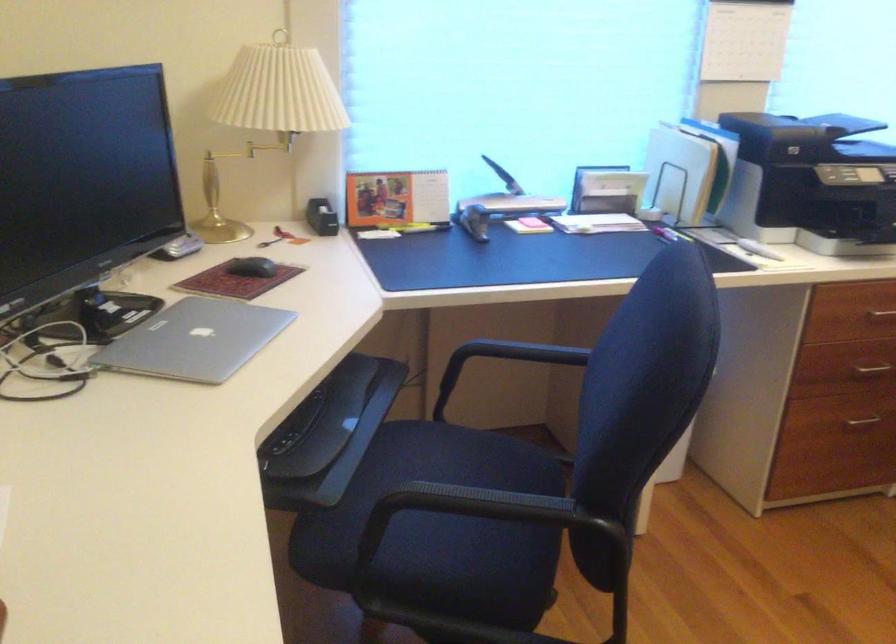
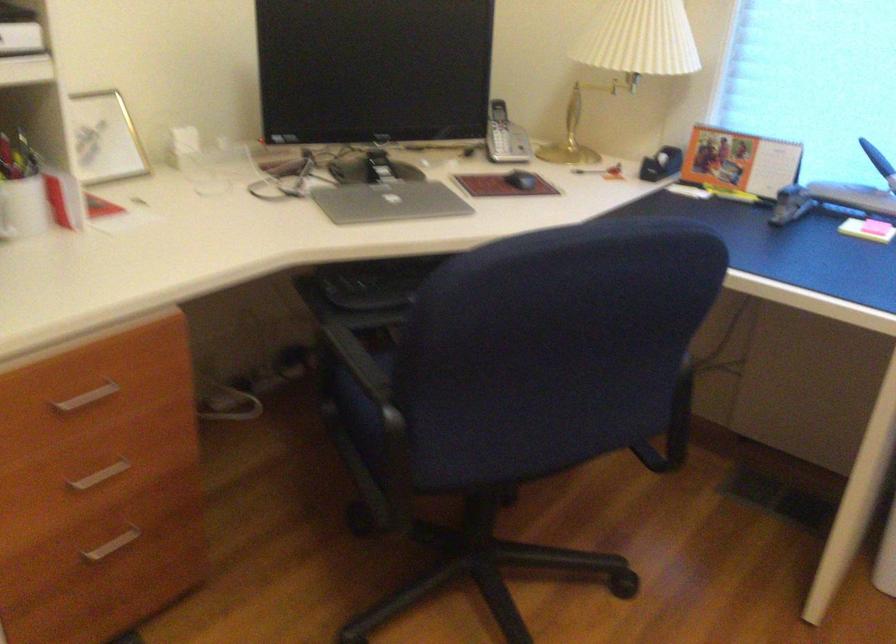
Where in the second image is the point corresponding to (x=259, y=268) from the first image?

(521, 180)